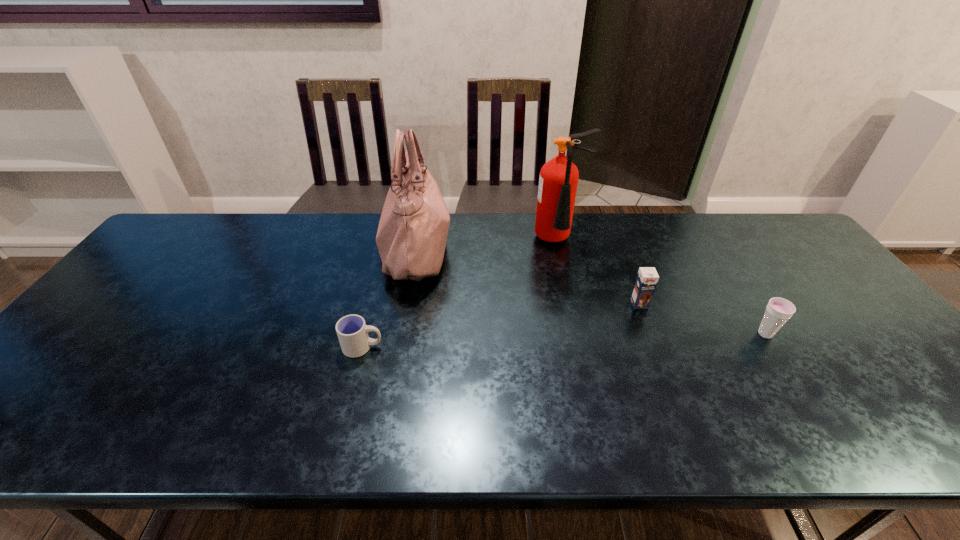
The image size is (960, 540). I want to click on vacant space situated 0.130m on the front label of the fourth object from left to right, so click(656, 346).

Locate an element on the screen. vacant space located on the left of the rightmost object is located at coordinates (667, 334).

This screenshot has height=540, width=960. Find the location of `free space located 0.180m with the handle on the side of the left cup`. free space located 0.180m with the handle on the side of the left cup is located at coordinates pos(456,347).

Locate an element on the screen. The image size is (960, 540). handbag located at the far edge is located at coordinates (411, 238).

Locate an element on the screen. This screenshot has height=540, width=960. fire extinguisher that is at the far edge is located at coordinates (558, 181).

Find the location of a particular element. The width and height of the screenshot is (960, 540). vacant space at the far edge of the desktop is located at coordinates (583, 252).

The height and width of the screenshot is (540, 960). In order to click on blank space at the near edge of the desktop in this screenshot , I will do `click(245, 448)`.

In the image, there is a desktop. Where is `vacant area at the left edge`? The image size is (960, 540). vacant area at the left edge is located at coordinates (32, 397).

Locate an element on the screen. The width and height of the screenshot is (960, 540). vacant region at the far left corner of the desktop is located at coordinates (225, 222).

At what (x,y) coordinates should I click in order to perform the action: click on free region at the far right corner of the desktop. Please return your answer as a coordinate pair (x, y). Looking at the image, I should click on (764, 246).